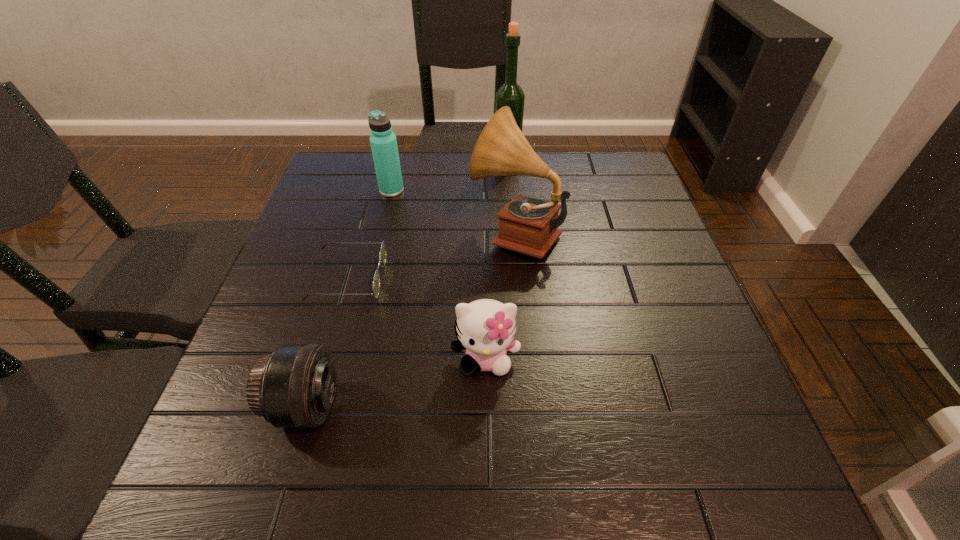
You are a GUI agent. You are given a task and a screenshot of the screen. Output one action in this format:
    pyautogui.click(x=<x>, y=<y>)
    Task: Click on the free location that satisfies the following two spatial constraints: 1. on the horn of the phonograph record; 2. on the front-facing side of the kitten
    The height and width of the screenshot is (540, 960).
    Given the screenshot: What is the action you would take?
    pyautogui.click(x=526, y=358)